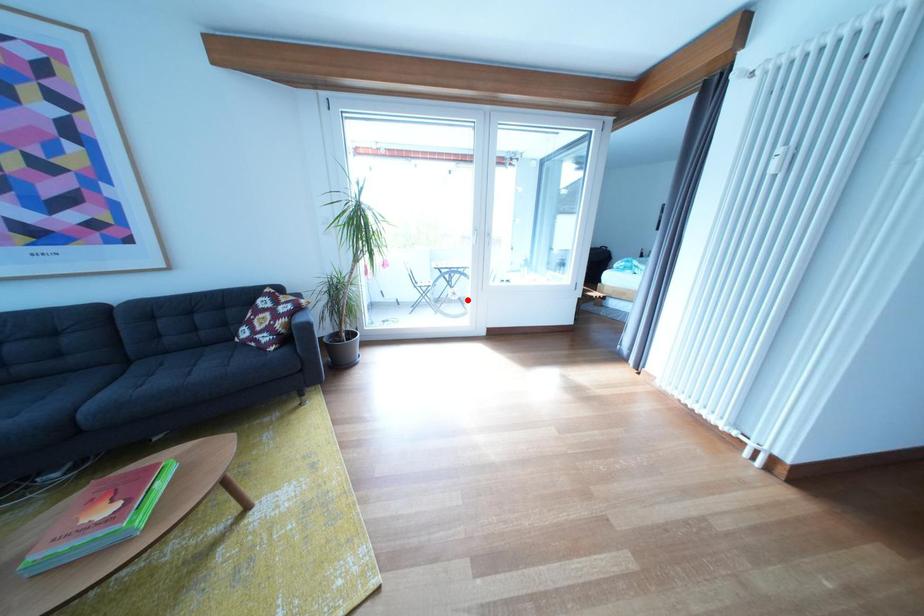
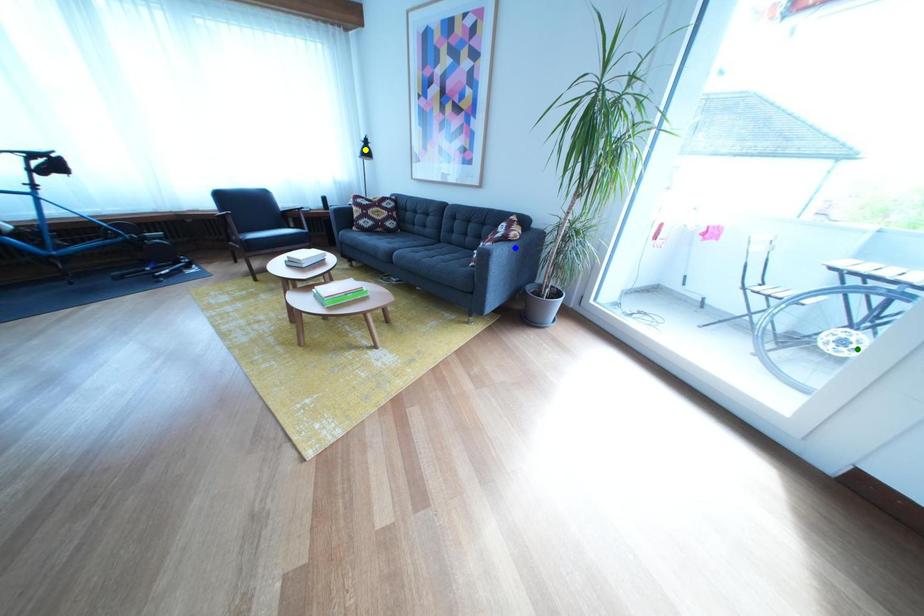
Question: I am providing you with two images of the same scene from different viewpoints. A red point is marked on the first image. You are given multiple points on the second image. Which point in image 2 is actually the same real-world point as the red point in image 1?

Choices:
 (A) blue point
 (B) green point
 (C) yellow point

Answer: (B)